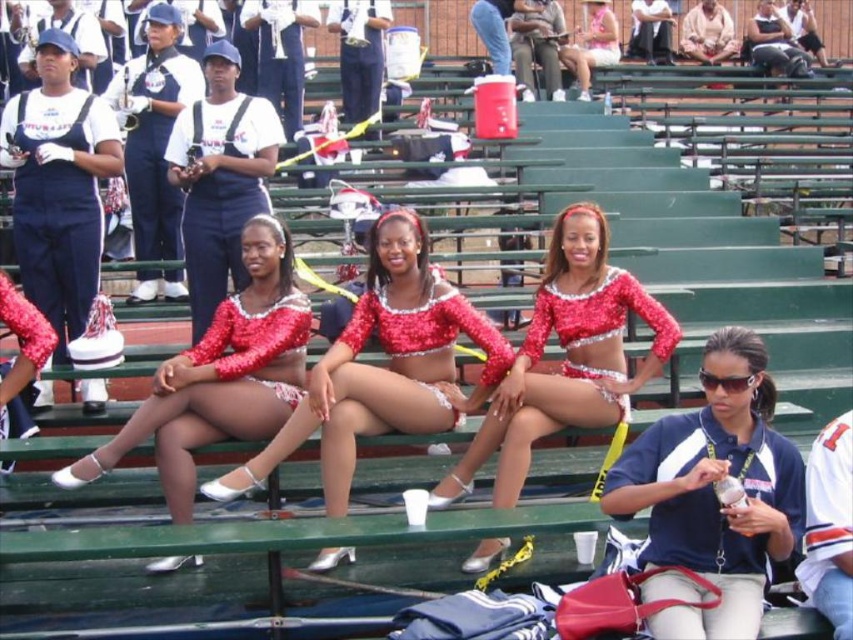
Question: Estimate the real-world distances between objects in this image. Which object is closer to the matte navy blue jumpsuit at left?

Choices:
 (A) sunglasses at center
 (B) shiny sequined outfit at center
 (C) shiny sequined top at center
 (D) sparkly red sequin top at center

Answer: (D)

Question: Where is shiny sequined top at center located in relation to shiny sequined outfit at center in the image?

Choices:
 (A) left
 (B) right

Answer: (A)

Question: Is sunglasses at center behind sparkly red sequin top at center?

Choices:
 (A) no
 (B) yes

Answer: (A)

Question: Can you confirm if shiny sequined top at center is smaller than sparkly red sequin top at center?

Choices:
 (A) yes
 (B) no

Answer: (B)

Question: Considering the real-world distances, which object is farthest from the sunglasses at center?

Choices:
 (A) sparkly red sequin top at center
 (B) matte navy blue jumpsuit at left
 (C) shiny sequined top at center

Answer: (B)

Question: Which point is farther to the camera?

Choices:
 (A) matte pink bikini at center
 (B) matte navy blue jumpsuit at left

Answer: (A)